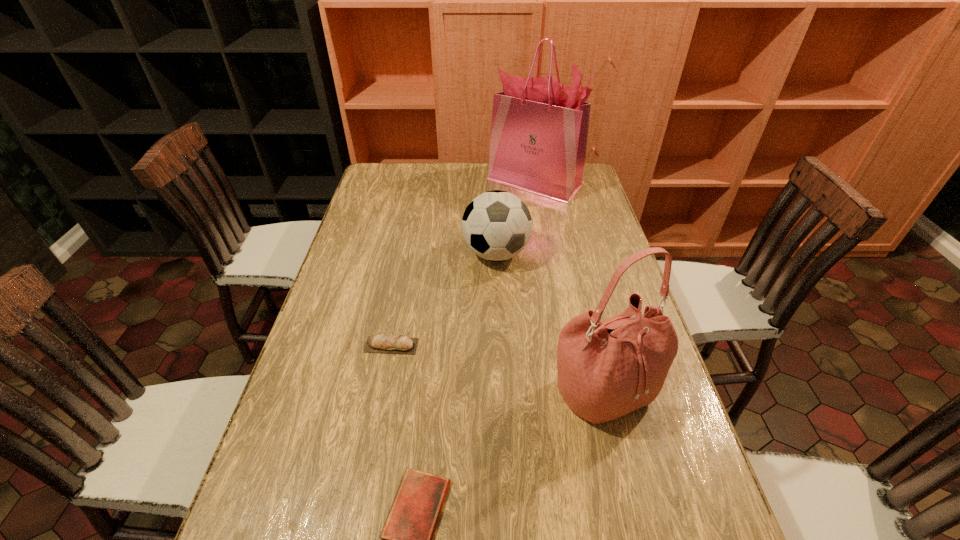
Where is `object at the far edge`? This screenshot has width=960, height=540. object at the far edge is located at coordinates (539, 131).

Locate an element on the screen. The width and height of the screenshot is (960, 540). object located in the left edge section of the desktop is located at coordinates (398, 344).

At what (x,y) coordinates should I click in order to perform the action: click on shopping bag located in the right edge section of the desktop. Please return your answer as a coordinate pair (x, y). This screenshot has height=540, width=960. Looking at the image, I should click on (539, 131).

Locate an element on the screen. handbag situated at the right edge is located at coordinates (606, 369).

This screenshot has height=540, width=960. Identify the location of object situated at the far right corner. (539, 131).

Find the location of a particular element. Image resolution: width=960 pixels, height=540 pixels. vacant space at the far edge of the desktop is located at coordinates (436, 171).

Identify the location of vacant point at the left edge. (368, 256).

The image size is (960, 540). In the image, there is a desktop. Identify the location of vacant space at the right edge. (586, 224).

Find the location of a particular element. The image size is (960, 540). vacant space at the far left corner is located at coordinates (405, 169).

Where is `empty space that is in between the second farthest object and the handbag`? Image resolution: width=960 pixels, height=540 pixels. empty space that is in between the second farthest object and the handbag is located at coordinates (550, 322).